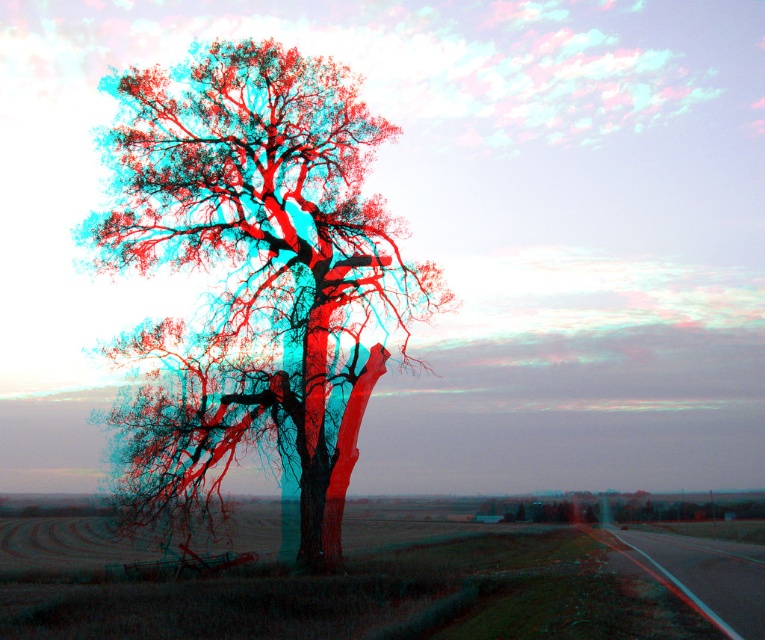
Is point (306, 531) farther from viewer compared to point (763, 563)?

Yes, point (306, 531) is behind point (763, 563).

Can you confirm if smooth bark tree at center is bigger than black asphalt highway at lower right?

Indeed, smooth bark tree at center has a larger size compared to black asphalt highway at lower right.

At what (x,y) coordinates should I click in order to perform the action: click on smooth bark tree at center. Please return your answer as a coordinate pair (x, y). The height and width of the screenshot is (640, 765). Looking at the image, I should click on (254, 282).

At what (x,y) coordinates should I click in order to perform the action: click on smooth bark tree at center. Please return your answer as a coordinate pair (x, y). Looking at the image, I should click on (254, 282).